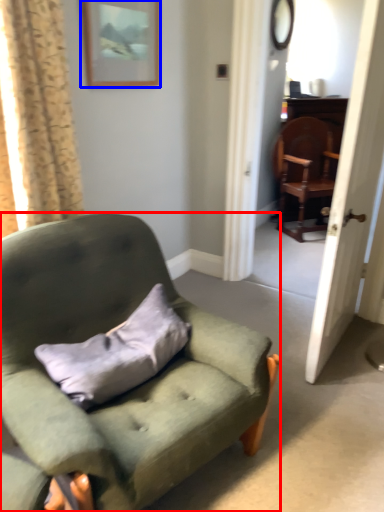
Question: Among these objects, which one is farthest to the camera, chair (highlighted by a red box) or picture frame (highlighted by a blue box)?

Choices:
 (A) chair
 (B) picture frame

Answer: (B)